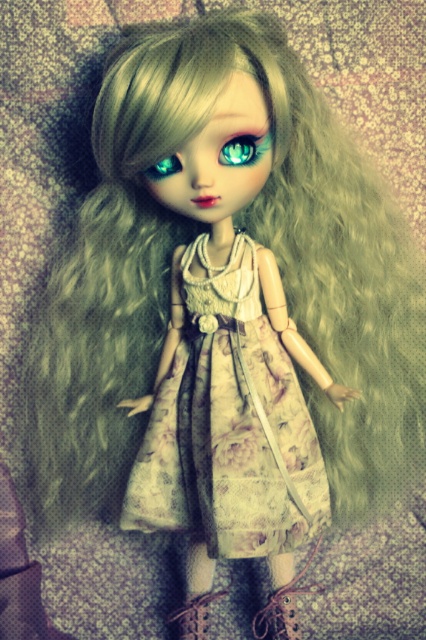
Question: Which point appears closest to the camera in this image?

Choices:
 (A) click(x=293, y=595)
 (B) click(x=204, y=600)

Answer: (A)

Question: Which object is positioned closest to the printed fabric dress at center?

Choices:
 (A) teal glossy eye at center
 (B) matte brown boot at lower center
 (C) teal glass eye at upper left
 (D) leather boot at lower center

Answer: (B)

Question: Is matte brown boot at lower center further to camera compared to teal glass eye at upper left?

Choices:
 (A) yes
 (B) no

Answer: (A)

Question: Does leather boot at lower center appear over teal glossy eye at center?

Choices:
 (A) no
 (B) yes

Answer: (A)

Question: Which of these objects is positioned farthest from the leather boot at lower center?

Choices:
 (A) teal glass eye at upper left
 (B) matte brown boot at lower center
 (C) teal glossy eye at center

Answer: (C)

Question: Is leather boot at lower center thinner than teal glossy eye at center?

Choices:
 (A) yes
 (B) no

Answer: (B)